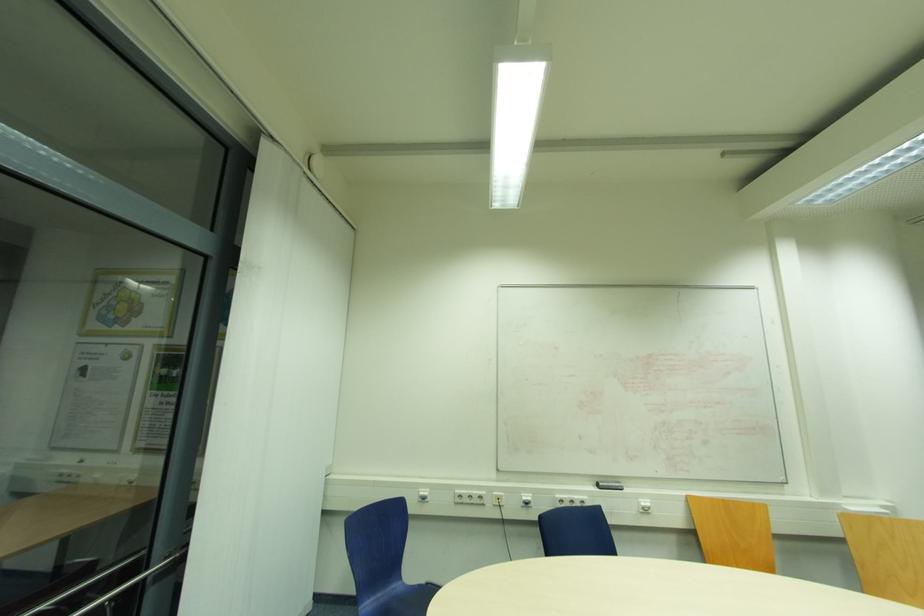
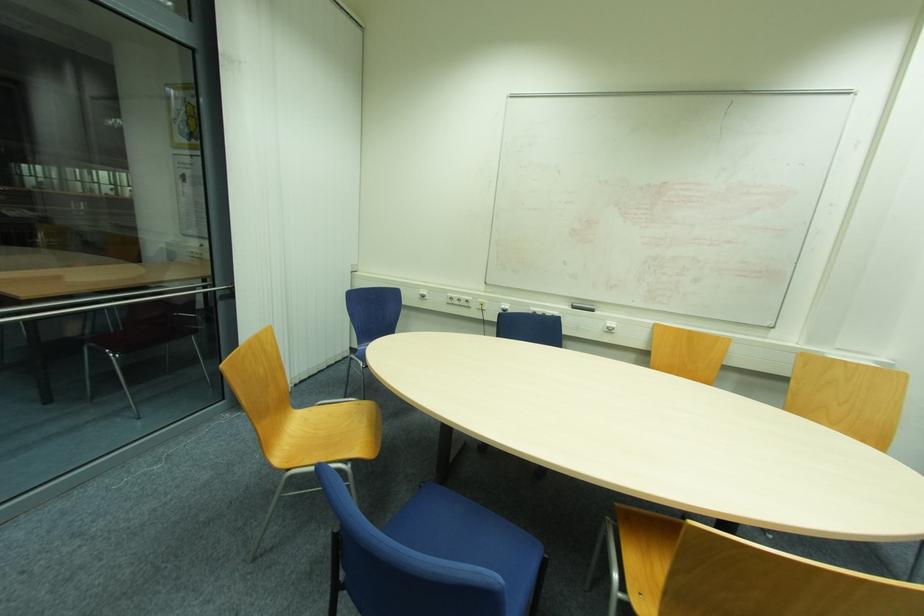
Question: How did the camera likely rotate?

Choices:
 (A) Left
 (B) Right
 (C) Up
 (D) Down

Answer: (D)